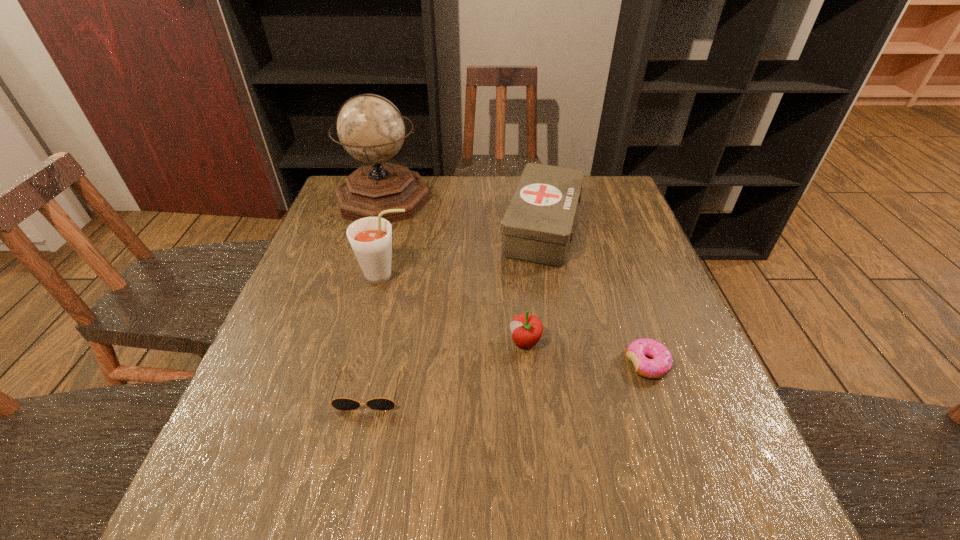
The image size is (960, 540). I want to click on free space at the far edge of the desktop, so click(468, 218).

You are a GUI agent. You are given a task and a screenshot of the screen. Output one action in this format:
    pyautogui.click(x=<x>, y=<y>)
    Task: Click on the vacant space at the left edge
    
    Given the screenshot: What is the action you would take?
    pyautogui.click(x=237, y=472)

You are a GUI agent. You are given a task and a screenshot of the screen. Output one action in this format:
    pyautogui.click(x=<x>, y=<y>)
    Task: Click on the blank space at the right edge of the desktop
    Image resolution: width=960 pixels, height=540 pixels.
    Given the screenshot: What is the action you would take?
    pyautogui.click(x=624, y=305)

Locate an element on the screen. vacant space at the far right corner of the desktop is located at coordinates (608, 211).

In the image, there is a desktop. At what (x,y) coordinates should I click in order to perform the action: click on vacant space at the near right corner. Please return your answer as a coordinate pair (x, y). Image resolution: width=960 pixels, height=540 pixels. Looking at the image, I should click on 696,483.

What are the coordinates of `free space between the doughnut and the first-aid kit` in the screenshot? It's located at (594, 295).

Locate an element on the screen. This screenshot has height=540, width=960. free space that is in between the globe and the sunglasses is located at coordinates (376, 294).

Find the location of a particular element. Image resolution: width=960 pixels, height=540 pixels. vacant space in between the tallest object and the sunglasses is located at coordinates (376, 294).

Identify the location of vacant point located between the fifth shortest object and the sunglasses. This screenshot has height=540, width=960. (377, 333).

I want to click on vacant region between the globe and the sunglasses, so click(376, 294).